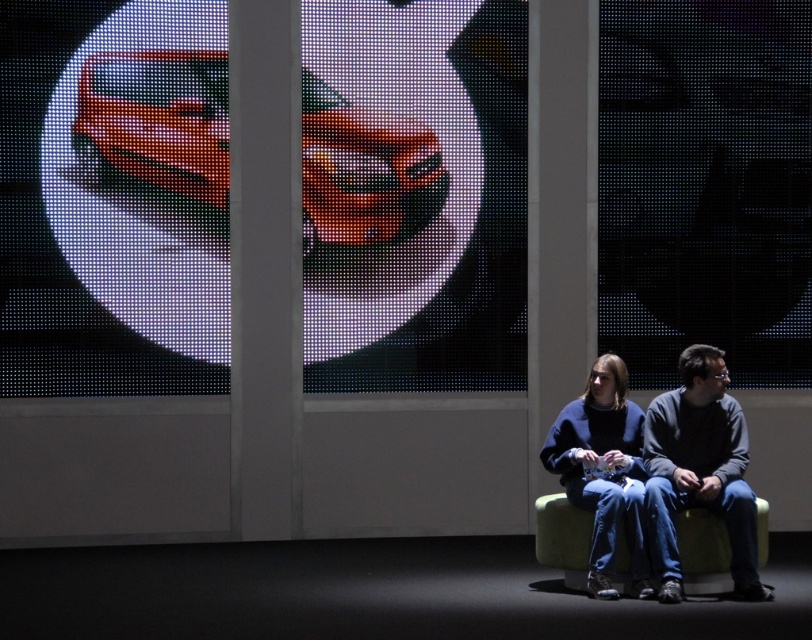
Question: Which point is farther to the camera?

Choices:
 (A) (599, 385)
 (B) (649, 497)

Answer: (A)

Question: Which object appears farthest from the camera in this image?

Choices:
 (A) blue fleece sweater at center
 (B) dark gray sweater at center right

Answer: (A)

Question: Is dark gray sweater at center right thinner than blue fleece sweater at center?

Choices:
 (A) no
 (B) yes

Answer: (A)

Question: Can you confirm if dark gray sweater at center right is positioned below blue fleece sweater at center?

Choices:
 (A) yes
 (B) no

Answer: (B)

Question: Is the position of dark gray sweater at center right more distant than that of blue fleece sweater at center?

Choices:
 (A) yes
 (B) no

Answer: (B)